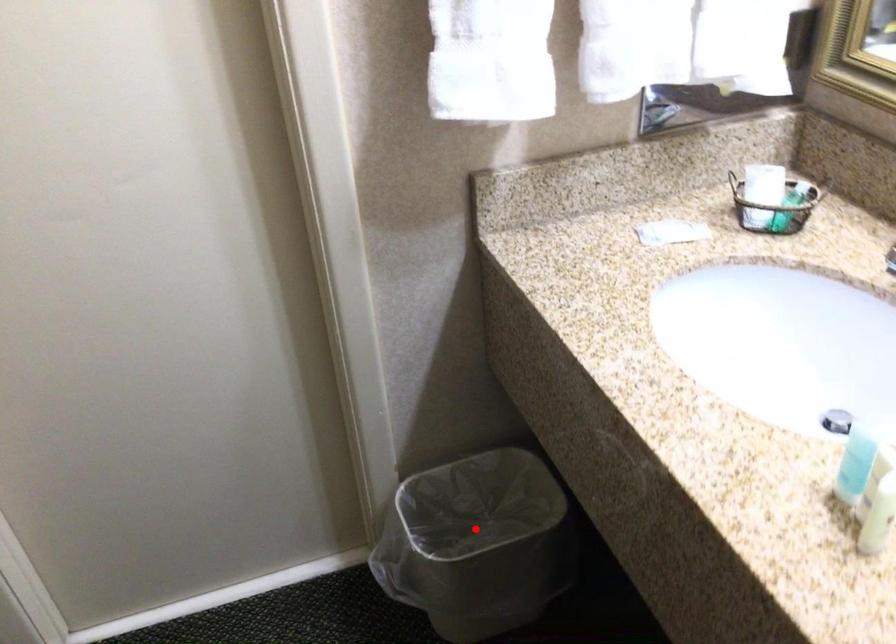
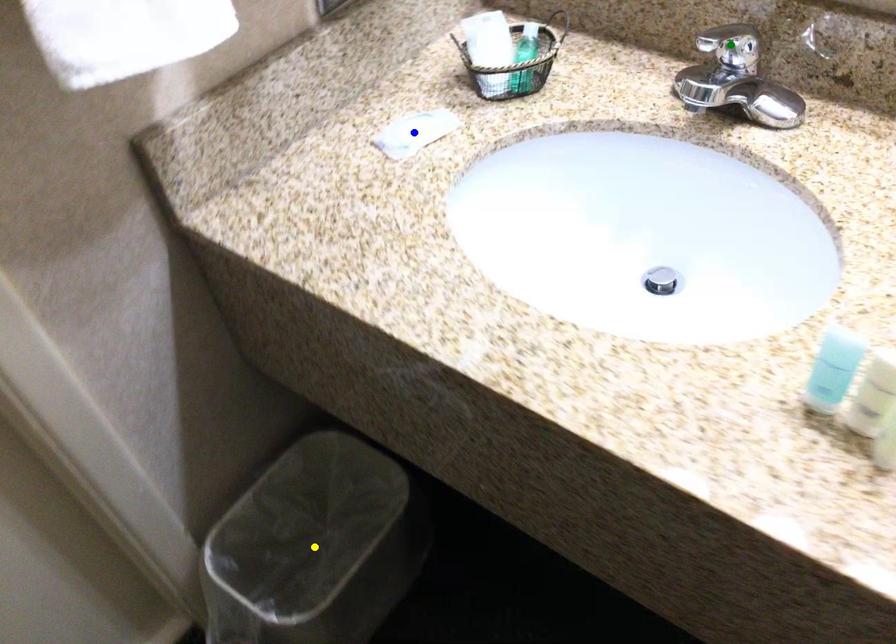
Question: I am providing you with two images of the same scene from different viewpoints. A red point is marked on the first image. You are given multiple points on the second image. In image 2, which mark is for the same physical point as the one in image 1?

Choices:
 (A) green point
 (B) yellow point
 (C) blue point

Answer: (B)